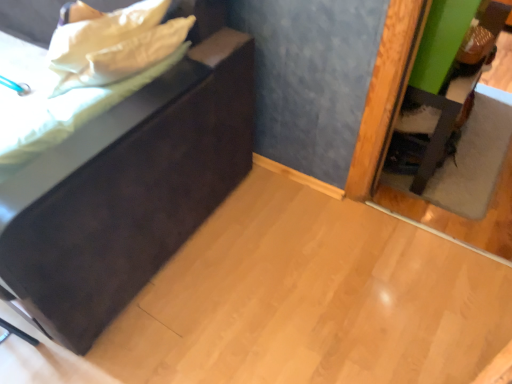
Image resolution: width=512 pixels, height=384 pixels. What do you see at coordinates (128, 193) in the screenshot?
I see `dark wood dresser at lower left` at bounding box center [128, 193].

In order to face dark wood dresser at lower left, should I rotate leftwards or rightwards?

A 32.945 degree turn to the left will do.

What is the approximate width of dark wood dresser at lower left?

dark wood dresser at lower left is 1.08 meters in width.

Locate an element on the screen. The height and width of the screenshot is (384, 512). dark wood dresser at lower left is located at coordinates (128, 193).

Image resolution: width=512 pixels, height=384 pixels. What are the coordinates of `dark wood dresser at lower left` in the screenshot? It's located at [128, 193].